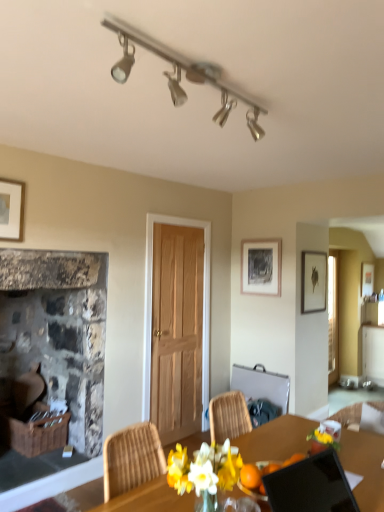
Question: Is metallic silver chair at center far from matte black picture frame at upper right, the second picture frame when ordered from left to right?

Choices:
 (A) yes
 (B) no

Answer: (B)

Question: Is metallic silver chair at center aimed at matte black picture frame at upper right, acting as the 1th picture frame starting from the right?

Choices:
 (A) yes
 (B) no

Answer: (B)

Question: Considering the relative positions of metallic silver chair at center and matte black picture frame at upper right, acting as the 1th picture frame starting from the right, in the image provided, is metallic silver chair at center behind matte black picture frame at upper right, acting as the 1th picture frame starting from the right,?

Choices:
 (A) yes
 (B) no

Answer: (B)

Question: Can you confirm if metallic silver chair at center is positioned to the left of matte black picture frame at upper right, acting as the 1th picture frame starting from the right?

Choices:
 (A) no
 (B) yes

Answer: (B)

Question: Considering the relative sizes of metallic silver chair at center and matte black picture frame at upper right, the second picture frame when ordered from left to right, in the image provided, is metallic silver chair at center shorter than matte black picture frame at upper right, the second picture frame when ordered from left to right,?

Choices:
 (A) no
 (B) yes

Answer: (B)

Question: Can you confirm if metallic silver chair at center is taller than matte black picture frame at upper right, the second picture frame when ordered from left to right?

Choices:
 (A) no
 (B) yes

Answer: (A)

Question: Does black glossy laptop at lower right have a greater height compared to matte black picture frame at upper right, the second picture frame when ordered from left to right?

Choices:
 (A) yes
 (B) no

Answer: (B)

Question: Is matte black picture frame at upper right, the second picture frame when ordered from left to right, surrounded by black glossy laptop at lower right?

Choices:
 (A) yes
 (B) no

Answer: (B)

Question: Is there a large distance between black glossy laptop at lower right and matte black picture frame at upper right, acting as the 1th picture frame starting from the right?

Choices:
 (A) no
 (B) yes

Answer: (B)

Question: From a real-world perspective, is black glossy laptop at lower right located higher than matte black picture frame at upper right, acting as the 1th picture frame starting from the right?

Choices:
 (A) yes
 (B) no

Answer: (B)

Question: Is black glossy laptop at lower right closer to the viewer compared to matte black picture frame at upper right, acting as the 1th picture frame starting from the right?

Choices:
 (A) yes
 (B) no

Answer: (A)

Question: Considering the relative positions of black glossy laptop at lower right and matte black picture frame at upper right, acting as the 1th picture frame starting from the right, in the image provided, is black glossy laptop at lower right to the right of matte black picture frame at upper right, acting as the 1th picture frame starting from the right, from the viewer's perspective?

Choices:
 (A) no
 (B) yes

Answer: (A)

Question: Does black glossy laptop at lower right have a greater height compared to matte black picture frame at upper center, the second picture frame viewed from the right?

Choices:
 (A) no
 (B) yes

Answer: (A)